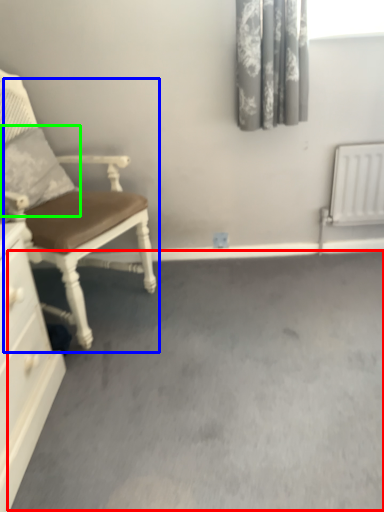
Question: Which object is positioned farthest from concrete (highlighted by a red box)? Select from chair (highlighted by a blue box) and pillow (highlighted by a green box).

Choices:
 (A) chair
 (B) pillow

Answer: (B)